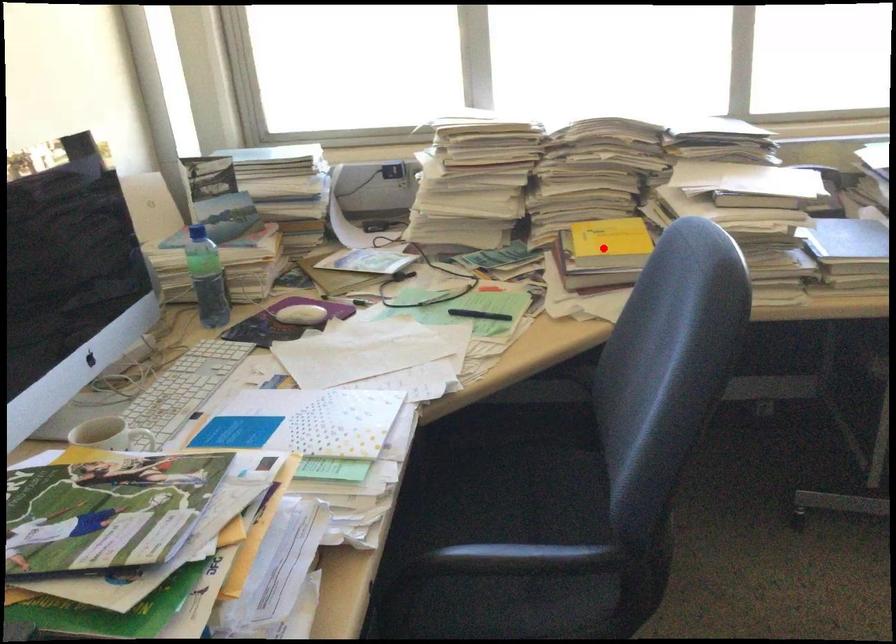
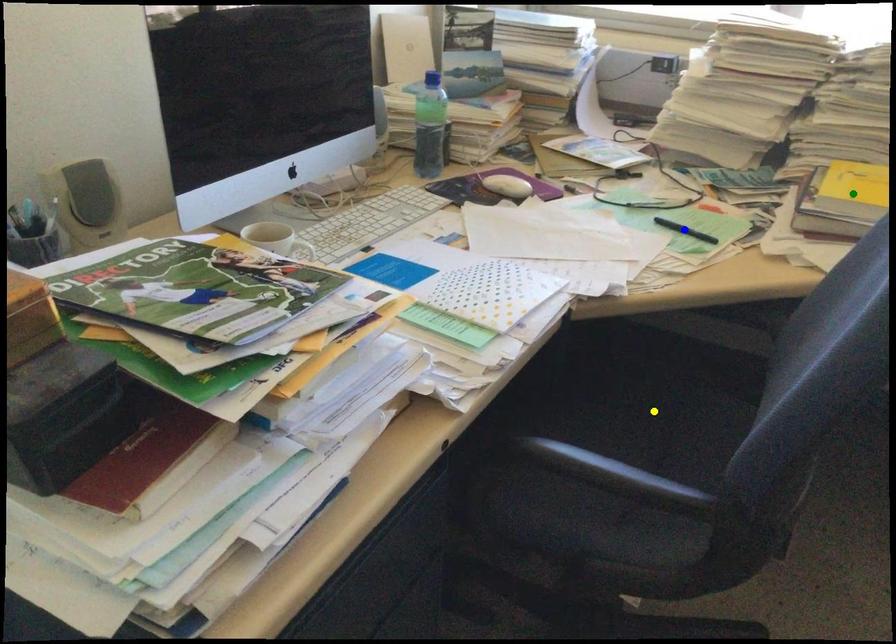
Question: I am providing you with two images of the same scene from different viewpoints. A red point is marked on the first image. You are given multiple points on the second image. Can you choose the point in image 2 that corresponds to the point in image 1?

Choices:
 (A) blue point
 (B) green point
 (C) yellow point

Answer: (B)